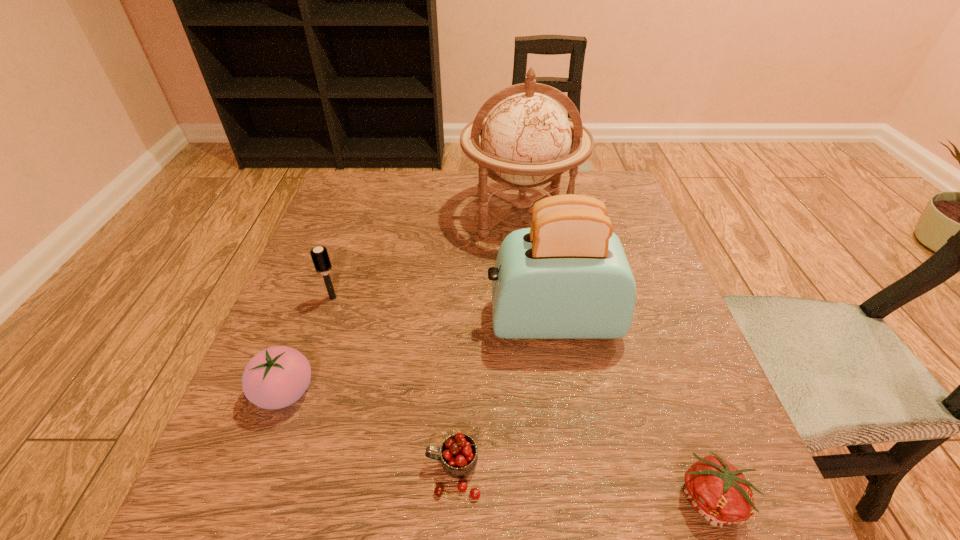
Where is `cherry at the near edge`? cherry at the near edge is located at coordinates (459, 456).

In order to click on tomato located in the near edge section of the desktop in this screenshot , I will do `click(718, 491)`.

Where is `hairbrush that is at the left edge`? Image resolution: width=960 pixels, height=540 pixels. hairbrush that is at the left edge is located at coordinates (319, 255).

What are the coordinates of `tomato that is at the left edge` in the screenshot? It's located at [276, 377].

Find the location of a particular element. globe that is at the right edge is located at coordinates (526, 139).

You are a GUI agent. You are given a task and a screenshot of the screen. Output one action in this format:
    pyautogui.click(x=<x>, y=<y>)
    Task: Click on the toaster located at the right edge
    This screenshot has height=540, width=960.
    Given the screenshot: What is the action you would take?
    pyautogui.click(x=567, y=277)

The height and width of the screenshot is (540, 960). In order to click on tomato present at the right edge in this screenshot , I will do `click(718, 491)`.

The height and width of the screenshot is (540, 960). I want to click on object located at the far right corner, so click(x=526, y=139).

You are a GUI agent. You are given a task and a screenshot of the screen. Output one action in this format:
    pyautogui.click(x=<x>, y=<y>)
    Task: Click on the object located at the near right corner
    
    Given the screenshot: What is the action you would take?
    pyautogui.click(x=718, y=491)

Where is `vacant space at the far edge of the desktop`? This screenshot has width=960, height=540. vacant space at the far edge of the desktop is located at coordinates (467, 204).